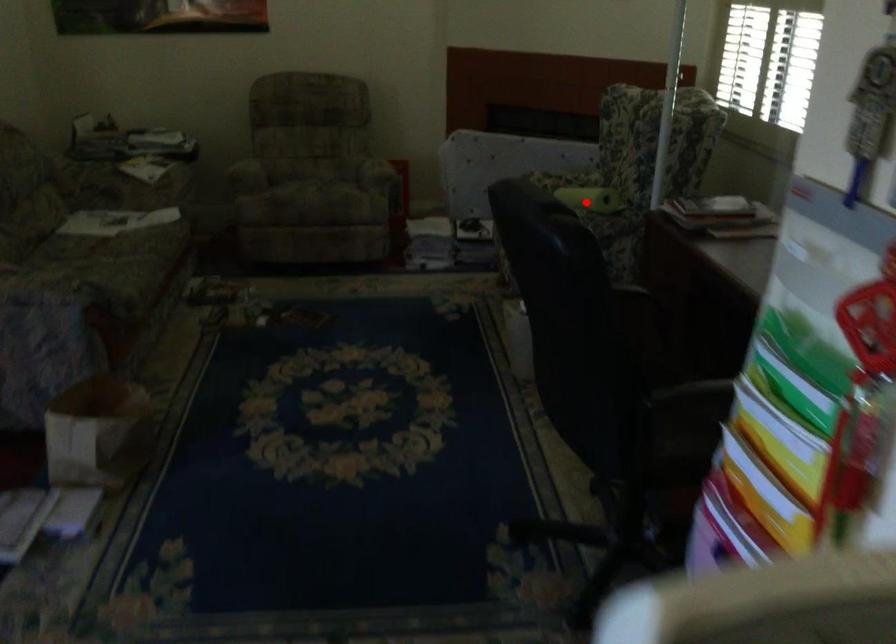
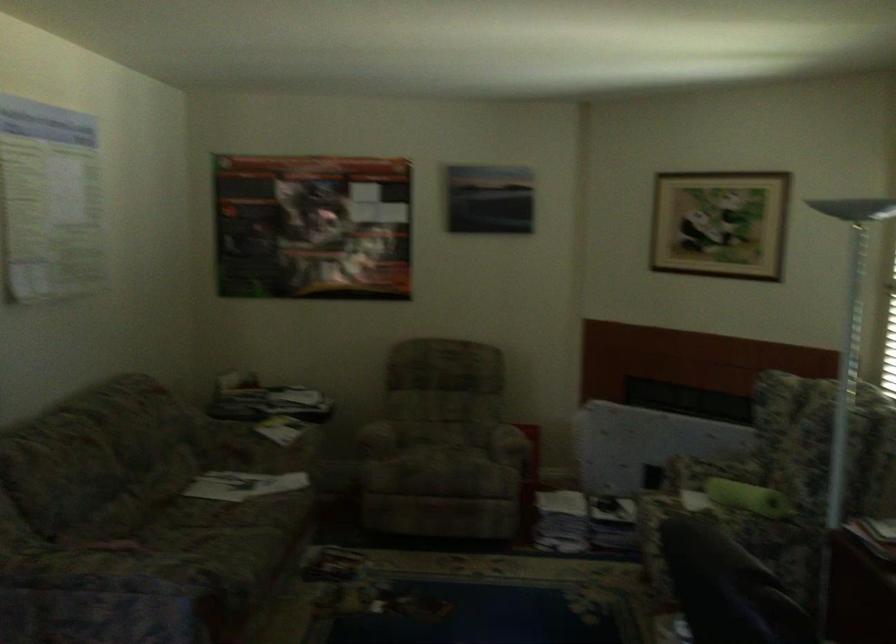
Locate, in the second image, the point that corresponds to the highlighted location in the first image.

(748, 498)